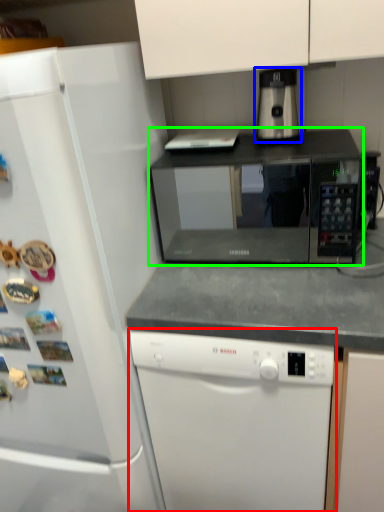
Question: Estimate the real-world distances between objects in this image. Which object is farther from dishwasher (highlighted by a red box), coffee machine (highlighted by a blue box) or microwave oven (highlighted by a green box)?

Choices:
 (A) coffee machine
 (B) microwave oven

Answer: (B)